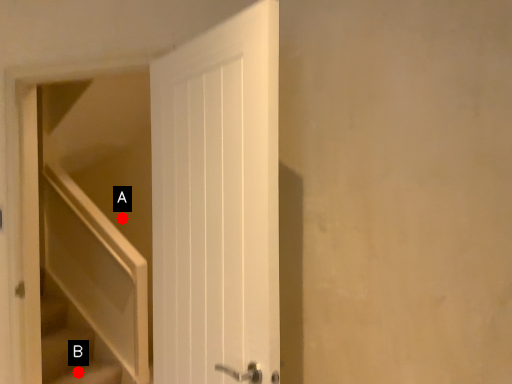
Question: Two points are circled on the image, labeled by A and B beside each circle. Which of the following is the closest to the observer?

Choices:
 (A) A is closer
 (B) B is closer

Answer: (B)